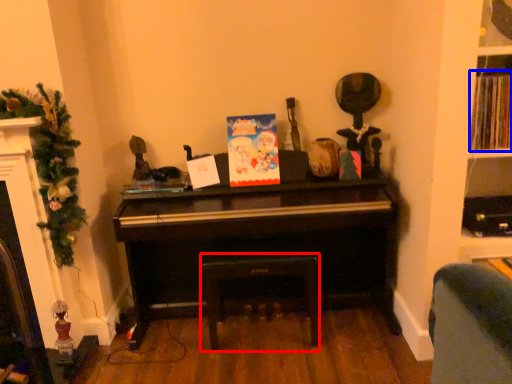
Question: Which object is closer to the camera taking this photo, stool (highlighted by a red box) or book (highlighted by a blue box)?

Choices:
 (A) stool
 (B) book

Answer: (B)